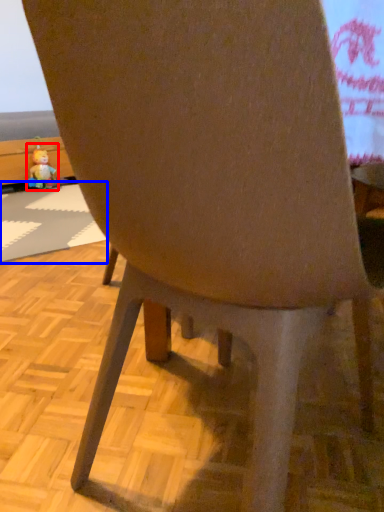
Question: Which object appears closest to the camera in this image, toy (highlighted by a red box) or place mat (highlighted by a blue box)?

Choices:
 (A) toy
 (B) place mat

Answer: (B)